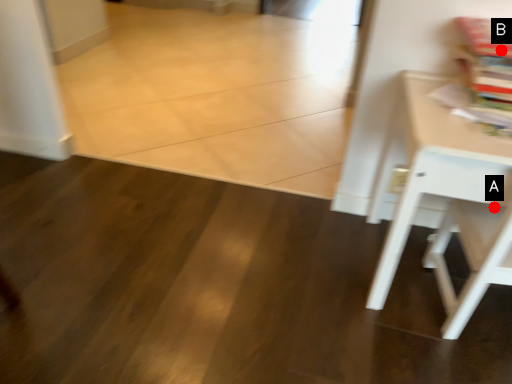
Question: Two points are circled on the image, labeled by A and B beside each circle. Which of the following is the closest to the observer?

Choices:
 (A) A is closer
 (B) B is closer

Answer: (B)